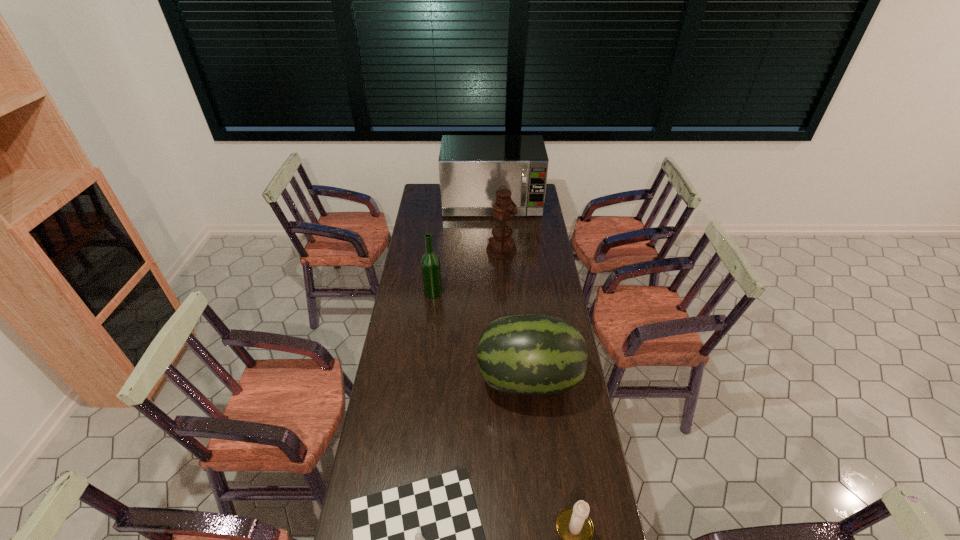
Locate an element on the screen. alcohol at the left edge is located at coordinates (430, 263).

Where is `microwave oven that is positioned at the right edge`? microwave oven that is positioned at the right edge is located at coordinates (472, 168).

This screenshot has height=540, width=960. What are the coordinates of `watermelon situated at the right edge` in the screenshot? It's located at (527, 355).

At what (x,y) coordinates should I click in order to perform the action: click on object present at the far left corner. Please return your answer as a coordinate pair (x, y). This screenshot has height=540, width=960. Looking at the image, I should click on (472, 168).

At what (x,y) coordinates should I click in order to perform the action: click on object situated at the far right corner. Please return your answer as a coordinate pair (x, y). The width and height of the screenshot is (960, 540). Looking at the image, I should click on (472, 168).

Find the location of a particular element. The height and width of the screenshot is (540, 960). vacant point at the left edge is located at coordinates (396, 427).

At what (x,y) coordinates should I click in order to perform the action: click on free space at the right edge of the desktop. Please return your answer as a coordinate pair (x, y). Looking at the image, I should click on (575, 489).

Where is `vacant space in between the watermelon and the microwave oven`? The height and width of the screenshot is (540, 960). vacant space in between the watermelon and the microwave oven is located at coordinates (511, 292).

At what (x,y) coordinates should I click in order to perform the action: click on empty location between the farthest object and the alcohol. Please return your answer as a coordinate pair (x, y). Looking at the image, I should click on (463, 248).

Select which object appears as the second closest to the second farthest object. Please provide its 2D coordinates. Your answer should be formatted as a tuple, i.e. [(x, y)], where the tuple contains the x and y coordinates of a point satisfying the conditions above.

[(430, 263)]